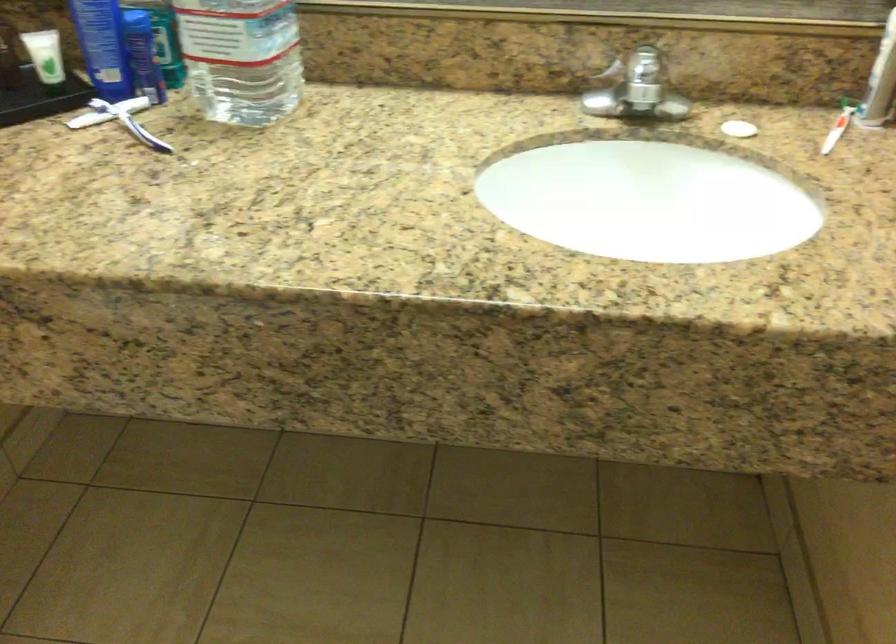
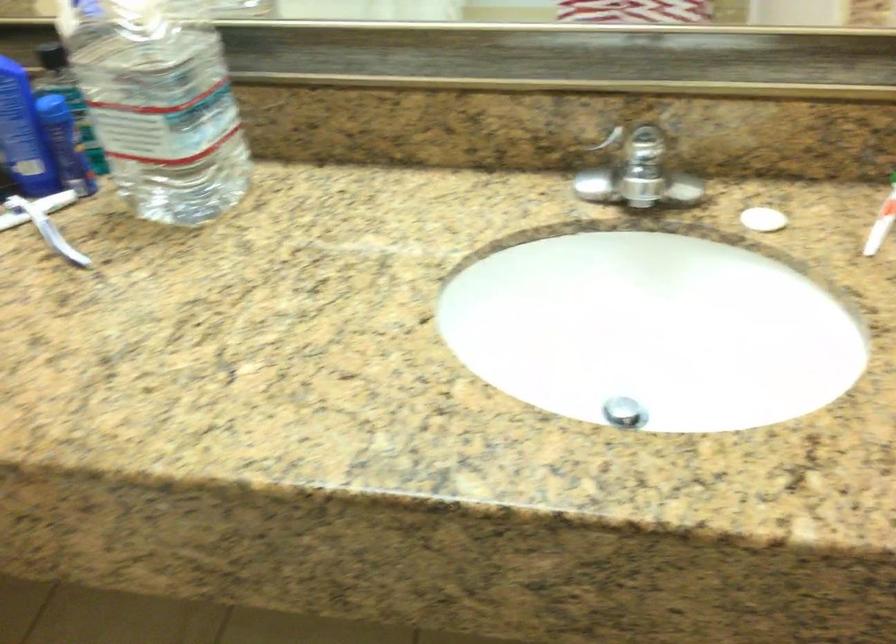
What movement of the cameraman would produce the second image?

The movement direction of the cameraman is right, forward.